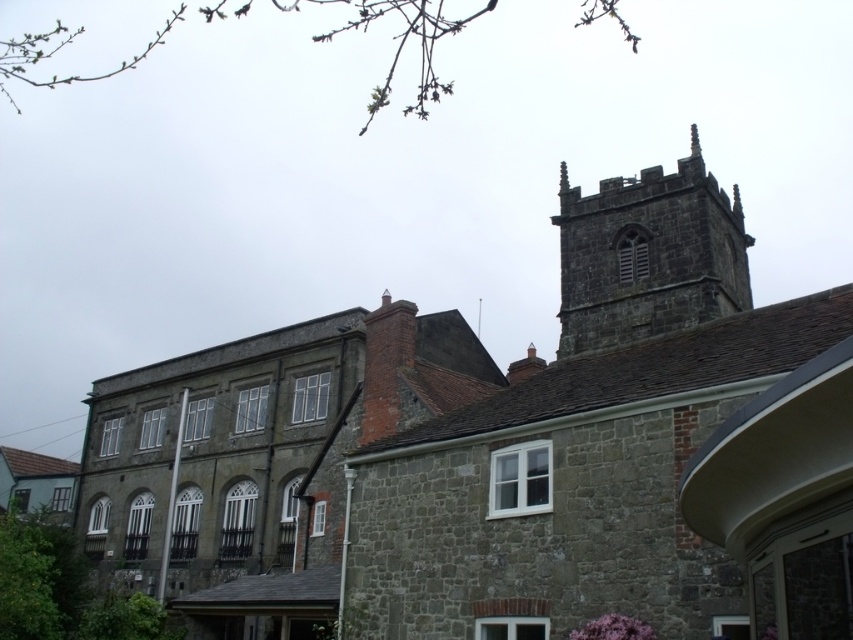
Can you confirm if dark stone church at upper center is wider than dark stone tower at upper right?

Yes.

Which is more to the right, dark stone church at upper center or dark stone tower at upper right?

Positioned to the right is dark stone tower at upper right.

Between point (842, 460) and point (573, 348), which one is positioned in front?

Point (842, 460) is in front.

Where is `dark stone church at upper center`? dark stone church at upper center is located at coordinates (520, 449).